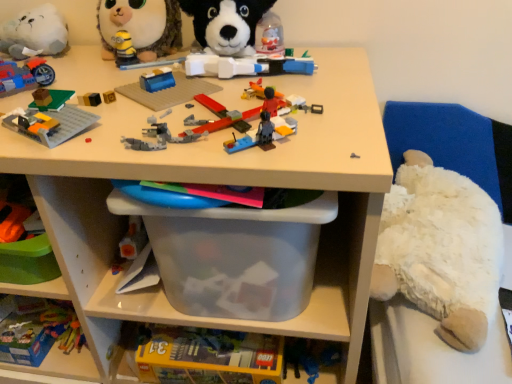
The height and width of the screenshot is (384, 512). Find the location of `vacant space behind translucent plastic baseplate at upper left, which is the fourth toy in left-to-right order`. vacant space behind translucent plastic baseplate at upper left, which is the fourth toy in left-to-right order is located at coordinates (100, 82).